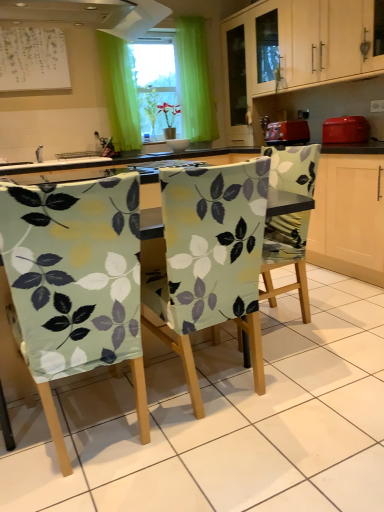
Locate an element on the screen. The width and height of the screenshot is (384, 512). matte red toaster at center, which appears as the 2th appliance when viewed from the right is located at coordinates (286, 130).

This screenshot has height=512, width=384. What do you see at coordinates (286, 130) in the screenshot? I see `matte red toaster at center, which is the first appliance in left-to-right order` at bounding box center [286, 130].

What do you see at coordinates (49, 160) in the screenshot? I see `white glossy sink at upper left` at bounding box center [49, 160].

Image resolution: width=384 pixels, height=512 pixels. I want to click on white glossy sink at upper left, so click(x=49, y=160).

You are a GUI agent. You are given a task and a screenshot of the screen. Output one action in this format:
    pyautogui.click(x=<x>, y=<y>)
    Task: Click on the green fabric curtain at upper center
    This screenshot has height=512, width=384.
    Given the screenshot: What is the action you would take?
    pyautogui.click(x=120, y=92)

Are matte red toaster at right, the first appliance when ordered from right to left, and white glossy sink at upper left located far from each other?

Yes, matte red toaster at right, the first appliance when ordered from right to left, and white glossy sink at upper left are located far from each other.

Is matte red toaster at right, the first appliance when ordered from right to left, in front of or behind white glossy sink at upper left in the image?

matte red toaster at right, the first appliance when ordered from right to left, is in front of white glossy sink at upper left.

Considering the relative sizes of matte red toaster at right, the first appliance when ordered from right to left, and white glossy sink at upper left in the image provided, is matte red toaster at right, the first appliance when ordered from right to left, taller than white glossy sink at upper left?

Correct, matte red toaster at right, the first appliance when ordered from right to left, is much taller as white glossy sink at upper left.

Considering the relative sizes of matte red toaster at right, the first appliance when ordered from right to left, and white glossy sink at upper left in the image provided, is matte red toaster at right, the first appliance when ordered from right to left, bigger than white glossy sink at upper left?

Yes.

Is light green fabric-covered chair at center, the third chair positioned from the left, at the left side of light wood cabinet at upper center?

Indeed, light green fabric-covered chair at center, the third chair positioned from the left, is positioned on the left side of light wood cabinet at upper center.

Is light green fabric-covered chair at center, the third chair positioned from the left, not within light wood cabinet at upper center?

Absolutely, light green fabric-covered chair at center, the third chair positioned from the left, is external to light wood cabinet at upper center.

Is light green fabric-covered chair at center, arranged as the 1th chair when viewed from the right, far away from light wood cabinet at upper center?

Indeed, light green fabric-covered chair at center, arranged as the 1th chair when viewed from the right, is not near light wood cabinet at upper center.

There is a light green fabric-covered chair at center, arranged as the 1th chair when viewed from the right. Identify the location of cabinetry above it (from a real-world perspective). The image size is (384, 512). (292, 50).

Does light green fabric-covered chair at center, the second chair viewed from the left, have a lesser height compared to white glossy sink at upper left?

No.

From the image's perspective, which one is positioned higher, light green fabric-covered chair at center, the second chair viewed from the left, or white glossy sink at upper left?

From the image's view, white glossy sink at upper left is above.

Is white glossy sink at upper left completely or partially inside light green fabric-covered chair at center, the second chair viewed from the left?

No, light green fabric-covered chair at center, the second chair viewed from the left, does not contain white glossy sink at upper left.

From the image's perspective, which object appears higher, white paper at upper left or light green fabric-covered chair at center, the second chair viewed from the left?

white paper at upper left, from the image's perspective.

Could you measure the distance between white paper at upper left and light green fabric-covered chair at center, the 2th chair positioned from the right?

white paper at upper left and light green fabric-covered chair at center, the 2th chair positioned from the right, are 2.77 meters apart from each other.

Would you say white paper at upper left is inside or outside light green fabric-covered chair at center, the 2th chair positioned from the right?

white paper at upper left lies outside light green fabric-covered chair at center, the 2th chair positioned from the right.

Is point (2, 27) positioned in front of point (188, 326)?

No.

Based on the photo, is white glossy sink at upper left completely or partially outside of white paper at upper left?

white glossy sink at upper left lies outside white paper at upper left's area.

Can you confirm if white glossy sink at upper left is smaller than white paper at upper left?

Yes.

From a real-world perspective, is white glossy sink at upper left beneath white paper at upper left?

Yes, from a real-world perspective, white glossy sink at upper left is beneath white paper at upper left.

Considering the positions of objects white glossy sink at upper left and white paper at upper left in the image provided, who is more to the right, white glossy sink at upper left or white paper at upper left?

white glossy sink at upper left is more to the right.

Consider the image. Can you confirm if light wood cabinet at upper center is shorter than matte red toaster at center, which is the first appliance in left-to-right order?

Incorrect, the height of light wood cabinet at upper center does not fall short of that of matte red toaster at center, which is the first appliance in left-to-right order.

Which object is more forward, light wood cabinet at upper center or matte red toaster at center, which appears as the 2th appliance when viewed from the right?

light wood cabinet at upper center is more forward.

At what (x,y) coordinates should I click in order to perform the action: click on cabinetry on the right side of matte red toaster at center, which is the first appliance in left-to-right order. Please return your answer as a coordinate pair (x, y). Looking at the image, I should click on (292, 50).

Which object is positioned more to the left, light wood cabinet at upper center or matte red toaster at center, which appears as the 2th appliance when viewed from the right?

From the viewer's perspective, matte red toaster at center, which appears as the 2th appliance when viewed from the right, appears more on the left side.

What's the angular difference between light green fabric-covered chair at center, the second chair viewed from the left, and matte red toaster at center, which appears as the 2th appliance when viewed from the right,'s facing directions?

They differ by 76.5 degrees in their facing directions.

Which object is wider, light green fabric-covered chair at center, the second chair viewed from the left, or matte red toaster at center, which appears as the 2th appliance when viewed from the right?

With larger width is light green fabric-covered chair at center, the second chair viewed from the left.

From the image's perspective, between light green fabric-covered chair at center, the second chair viewed from the left, and matte red toaster at center, which appears as the 2th appliance when viewed from the right, which one is located above?

matte red toaster at center, which appears as the 2th appliance when viewed from the right.

Could you measure the distance between light green fabric-covered chair at center, the 2th chair positioned from the right, and matte red toaster at center, which is the first appliance in left-to-right order?

light green fabric-covered chair at center, the 2th chair positioned from the right, is 6.50 feet away from matte red toaster at center, which is the first appliance in left-to-right order.

Where is `sink below the matte red toaster at right, the first appliance when ordered from right to left (from the image's perspective)`? The width and height of the screenshot is (384, 512). sink below the matte red toaster at right, the first appliance when ordered from right to left (from the image's perspective) is located at coordinates coord(49,160).

Which chair is the 1st one when counting from the front of the light wood cabinet at upper center? Please provide its 2D coordinates.

[(286, 253)]

Considering their positions, is matte red toaster at right, arranged as the 2th appliance when viewed from the left, positioned closer to white paper at upper left than light green fabric-covered chair at center, the 2th chair positioned from the right?

Based on the image, matte red toaster at right, arranged as the 2th appliance when viewed from the left, appears to be nearer to white paper at upper left.

Looking at the image, which one is located further to green fabric curtain at upper center, light green fabric-covered chair at center, the third chair positioned from the left, or matte red toaster at right, arranged as the 2th appliance when viewed from the left?

light green fabric-covered chair at center, the third chair positioned from the left, is further to green fabric curtain at upper center.

Which object lies further to the anchor point matte red toaster at center, which is the first appliance in left-to-right order, matte red toaster at right, the first appliance when ordered from right to left, or light green fabric-covered chair at center, which ranks as the first chair in left-to-right order?

Based on the image, light green fabric-covered chair at center, which ranks as the first chair in left-to-right order, appears to be further to matte red toaster at center, which is the first appliance in left-to-right order.

Based on the photo, estimate the real-world distances between objects in this image. Which object is further from light wood cabinet at upper center, matte red toaster at right, the first appliance when ordered from right to left, or green fabric curtain at upper center?

green fabric curtain at upper center lies further to light wood cabinet at upper center than the other object.

When comparing their distances from light wood cabinet at upper center, does light green fabric-covered chair at center, the 2th chair positioned from the right, or green fabric curtain at upper center seem closer?

green fabric curtain at upper center is positioned closer to the anchor light wood cabinet at upper center.

Considering their positions, is light green fabric-covered chair at center, the 2th chair positioned from the right, positioned further to matte red toaster at right, the first appliance when ordered from right to left, than matte red toaster at center, which appears as the 2th appliance when viewed from the right?

Based on the image, light green fabric-covered chair at center, the 2th chair positioned from the right, appears to be further to matte red toaster at right, the first appliance when ordered from right to left.

Considering their positions, is matte red toaster at center, which is the first appliance in left-to-right order, positioned closer to white paper at upper left than light green fabric-covered chair at center, the third chair positioned from the left?

matte red toaster at center, which is the first appliance in left-to-right order, is closer to white paper at upper left.

Based on their spatial positions, is light wood cabinet at upper center or white glossy sink at upper left further from light green fabric-covered chair at center, the 2th chair positioned from the right?

The object further to light green fabric-covered chair at center, the 2th chair positioned from the right, is light wood cabinet at upper center.

At what (x,y) coordinates should I click in order to perform the action: click on cabinetry between light green fabric-covered chair at center, placed as the 3th chair when sorted from right to left, and matte red toaster at center, which is the first appliance in left-to-right order, from front to back. Please return your answer as a coordinate pair (x, y). Looking at the image, I should click on (292, 50).

The image size is (384, 512). Identify the location of chair positioned between light green fabric-covered chair at center, the second chair viewed from the left, and matte red toaster at center, which is the first appliance in left-to-right order, from near to far. (286, 253).

The height and width of the screenshot is (512, 384). Identify the location of sink between light green fabric-covered chair at center, the second chair viewed from the left, and white paper at upper left in the front-back direction. click(x=49, y=160).

Where is `sink between white paper at upper left and matte red toaster at right, arranged as the 2th appliance when viewed from the left, from left to right`? The width and height of the screenshot is (384, 512). sink between white paper at upper left and matte red toaster at right, arranged as the 2th appliance when viewed from the left, from left to right is located at coordinates (49, 160).